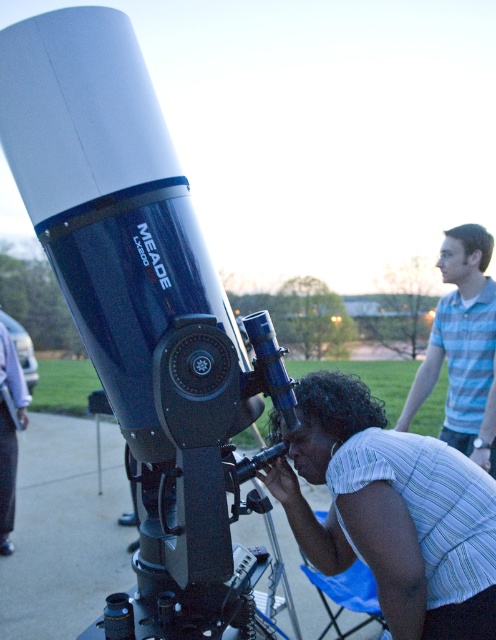
In the scene shown: You are an astronomer trying to adjust the telescope. You need to reach the matte black telescope at center while standing near the white striped shirt at center. Which direction should you move to get to the telescope?

The matte black telescope at center is to the left of the white striped shirt at center, so you should move to your left to reach it.

You are an astronomer trying to adjust the focus of the telescope. Since you are standing in front of the telescope, which object is closer to you, the matte black telescope at center or the blue striped shirt at upper right?

The matte black telescope at center is closer to the viewer than the blue striped shirt at upper right, so the astronomer should focus on adjusting the telescope first as it is nearer.

You are an astronomer trying to align your telescope with a star. You have two points of reference in the sky marked as point 1 at coordinates (96, 362) and point 2 at coordinates (433, 516). Which point should you focus on first if you want to adjust the telescope from closer to farther distances?

You should focus on point 1 at coordinates (96, 362) first because it is in front of point 2 at coordinates (433, 516), meaning it is closer and you can adjust the telescope from closer to farther distances starting there.